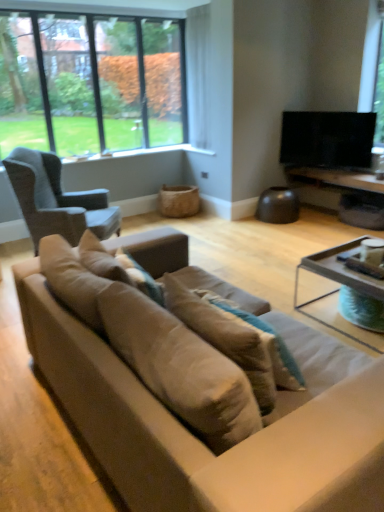
Question: From the image's perspective, is suede-like beige pillow at center, acting as the 2th pillow starting from the right, located beneath black glossy tv at upper right?

Choices:
 (A) no
 (B) yes

Answer: (B)

Question: Is suede-like beige pillow at center, acting as the 2th pillow starting from the right, shorter than black glossy tv at upper right?

Choices:
 (A) no
 (B) yes

Answer: (B)

Question: Can you confirm if suede-like beige pillow at center, acting as the 2th pillow starting from the right, is positioned to the right of black glossy tv at upper right?

Choices:
 (A) yes
 (B) no

Answer: (B)

Question: Is suede-like beige pillow at center, acting as the 2th pillow starting from the right, positioned with its back to black glossy tv at upper right?

Choices:
 (A) yes
 (B) no

Answer: (B)

Question: Can you confirm if suede-like beige pillow at center, acting as the 2th pillow starting from the right, is thinner than black glossy tv at upper right?

Choices:
 (A) yes
 (B) no

Answer: (B)

Question: Is wooden tray at lower right taller or shorter than suede couch at center?

Choices:
 (A) short
 (B) tall

Answer: (A)

Question: Looking at their shapes, would you say wooden tray at lower right is wider or thinner than suede couch at center?

Choices:
 (A) thin
 (B) wide

Answer: (A)

Question: Considering the positions of point (316, 178) and point (29, 339), is point (316, 178) closer or farther from the camera than point (29, 339)?

Choices:
 (A) closer
 (B) farther

Answer: (B)

Question: From the image's perspective, relative to suede couch at center, is wooden tray at lower right above or below?

Choices:
 (A) below
 (B) above

Answer: (B)

Question: In terms of height, does wooden tray at lower right look taller or shorter compared to suede-like beige pillow at center, which ranks as the 2th pillow in left-to-right order?

Choices:
 (A) tall
 (B) short

Answer: (B)

Question: Looking at their shapes, would you say wooden tray at lower right is wider or thinner than suede-like beige pillow at center, which ranks as the 2th pillow in left-to-right order?

Choices:
 (A) wide
 (B) thin

Answer: (A)

Question: Do you think wooden tray at lower right is within suede-like beige pillow at center, which ranks as the 2th pillow in left-to-right order, or outside of it?

Choices:
 (A) outside
 (B) inside

Answer: (A)

Question: In the image, is wooden tray at lower right positioned in front of or behind suede-like beige pillow at center, positioned as the 1th pillow in right-to-left order?

Choices:
 (A) front
 (B) behind

Answer: (B)

Question: Relative to clear glass window at upper left, is dark gray fabric chair at left in front or behind?

Choices:
 (A) behind
 (B) front

Answer: (B)

Question: Looking at their shapes, would you say dark gray fabric chair at left is wider or thinner than clear glass window at upper left?

Choices:
 (A) thin
 (B) wide

Answer: (B)